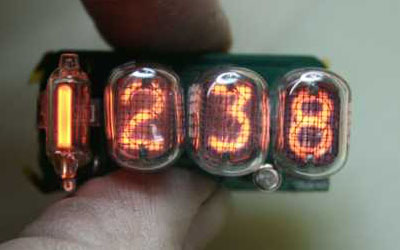
Image resolution: width=400 pixels, height=250 pixels. I want to click on top left corner empty space, so click(4, 2).